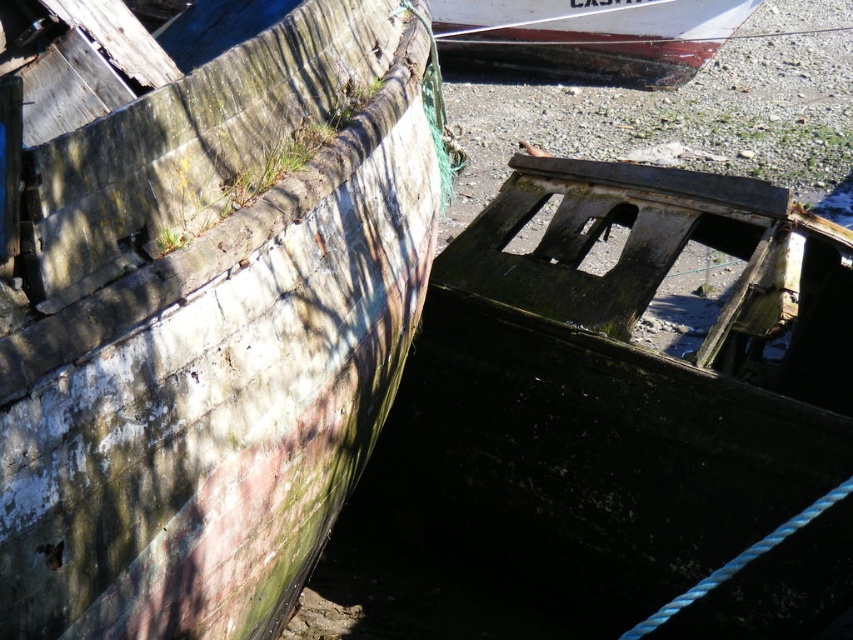
Question: Which object is positioned closest to the dark green weathered wood boat at lower right?

Choices:
 (A) weathered wood boat at left
 (B) white painted wood boat at upper center

Answer: (A)

Question: Among these objects, which one is farthest from the camera?

Choices:
 (A) dark green weathered wood boat at lower right
 (B) weathered wood boat at left
 (C) white painted wood boat at upper center

Answer: (C)

Question: Does weathered wood boat at left appear under dark green weathered wood boat at lower right?

Choices:
 (A) no
 (B) yes

Answer: (A)

Question: Which point is closer to the camera?

Choices:
 (A) (749, 225)
 (B) (532, 28)

Answer: (A)

Question: Is weathered wood boat at left further to camera compared to white painted wood boat at upper center?

Choices:
 (A) no
 (B) yes

Answer: (A)

Question: Does dark green weathered wood boat at lower right have a greater width compared to white painted wood boat at upper center?

Choices:
 (A) no
 (B) yes

Answer: (A)